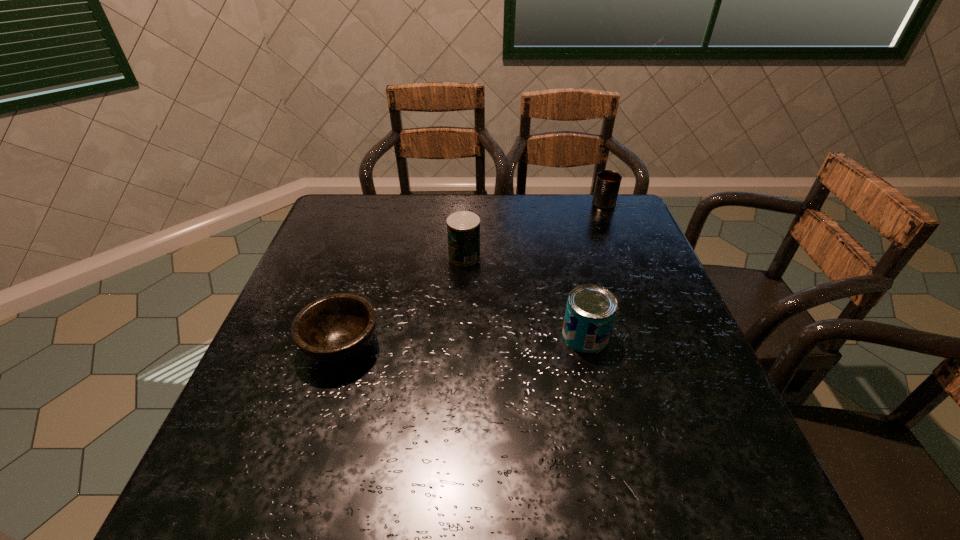
In order to click on the rightmost can in this screenshot , I will do `click(608, 182)`.

The width and height of the screenshot is (960, 540). I want to click on the rightmost object, so click(x=608, y=182).

Image resolution: width=960 pixels, height=540 pixels. What are the coordinates of `the second object from left to right` in the screenshot? It's located at (463, 227).

The width and height of the screenshot is (960, 540). In order to click on the third nearest object in this screenshot , I will do `click(463, 227)`.

Identify the location of the second can from right to left. This screenshot has width=960, height=540. (590, 311).

You are a GUI agent. You are given a task and a screenshot of the screen. Output one action in this format:
    pyautogui.click(x=<x>, y=<y>)
    Task: Click on the nearest can
    
    Given the screenshot: What is the action you would take?
    pyautogui.click(x=590, y=311)

Identify the location of the leftmost object. (335, 328).

Where is `the shortest object`? This screenshot has height=540, width=960. the shortest object is located at coordinates (335, 328).

Where is `free space located on the left of the rightmost can`? This screenshot has width=960, height=540. free space located on the left of the rightmost can is located at coordinates (505, 204).

Where is `vacant area situated 0.160m on the left of the leftmost can`? Image resolution: width=960 pixels, height=540 pixels. vacant area situated 0.160m on the left of the leftmost can is located at coordinates (390, 256).